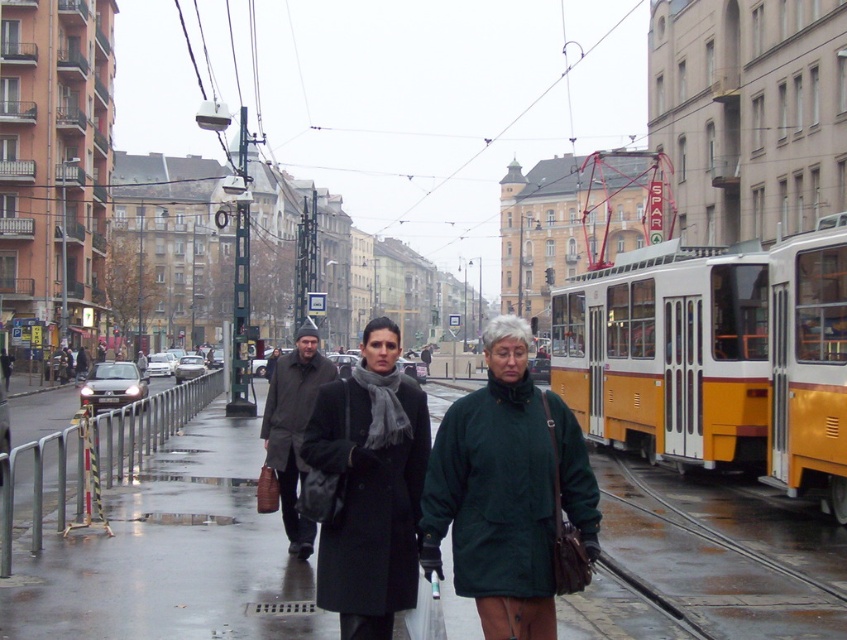
You are a delivery robot with a 2 meter long package. You need to move from the shiny asphalt pavement at center to the matte black coat at center. Is there enough space for your package to fit between them?

The distance between the shiny asphalt pavement at center and the matte black coat at center is 8.97 meters. Since your package is 2 meters long, there is sufficient space for it to fit between them.

From the picture: You are a delivery person needing to pass between the green matte coat at center and the matte black coat at center on a narrow sidewalk. The delivery cart you use is 20 inches wide. Can you safely navigate through the space between them?

The distance between the green matte coat at center and the matte black coat at center is 20.24 inches. Since your delivery cart is 20 inches wide, you can safely navigate through the space as there is enough clearance.